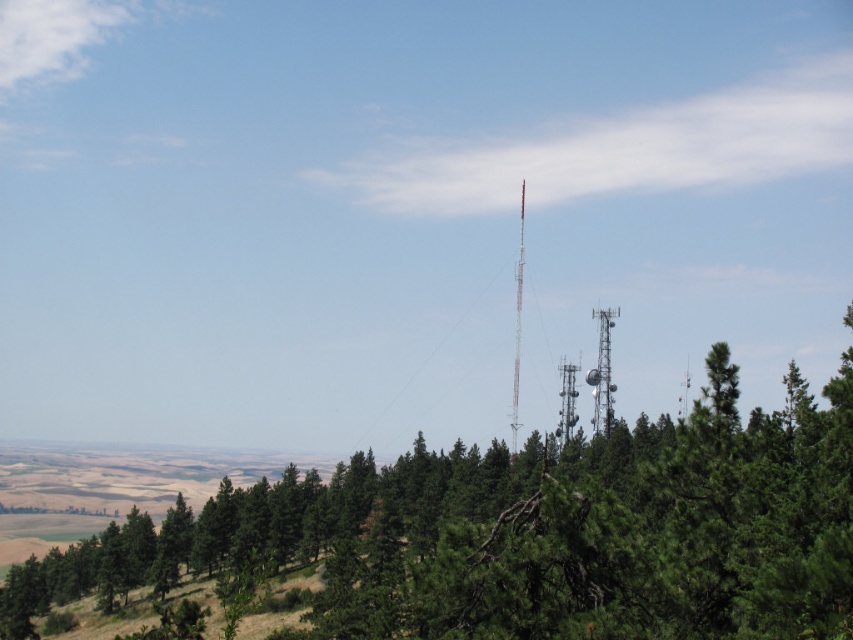
Does point (608, 339) come behind point (566, 385)?

No, (608, 339) is in front of (566, 385).

I want to click on silver metallic tower at center-right, so click(602, 372).

Does silver metallic tower at center-right have a lesser width compared to metallic tower at center?

Correct, silver metallic tower at center-right's width is less than metallic tower at center's.

In the scene shown: Is silver metallic tower at center-right below metallic tower at center?

Yes, silver metallic tower at center-right is below metallic tower at center.

Which is in front, point (595, 401) or point (515, 307)?

Positioned in front is point (595, 401).

Locate an element on the screen. silver metallic tower at center-right is located at coordinates (602, 372).

Is green textured tree at center thinner than silver metallic tower at center-right?

No, green textured tree at center is not thinner than silver metallic tower at center-right.

Who is more forward, (757, 497) or (601, 356)?

Positioned in front is point (757, 497).

You are a GUI agent. You are given a task and a screenshot of the screen. Output one action in this format:
    pyautogui.click(x=<x>, y=<y>)
    Task: Click on the green textured tree at center
    Image resolution: width=853 pixels, height=640 pixels.
    Given the screenshot: What is the action you would take?
    pyautogui.click(x=523, y=534)